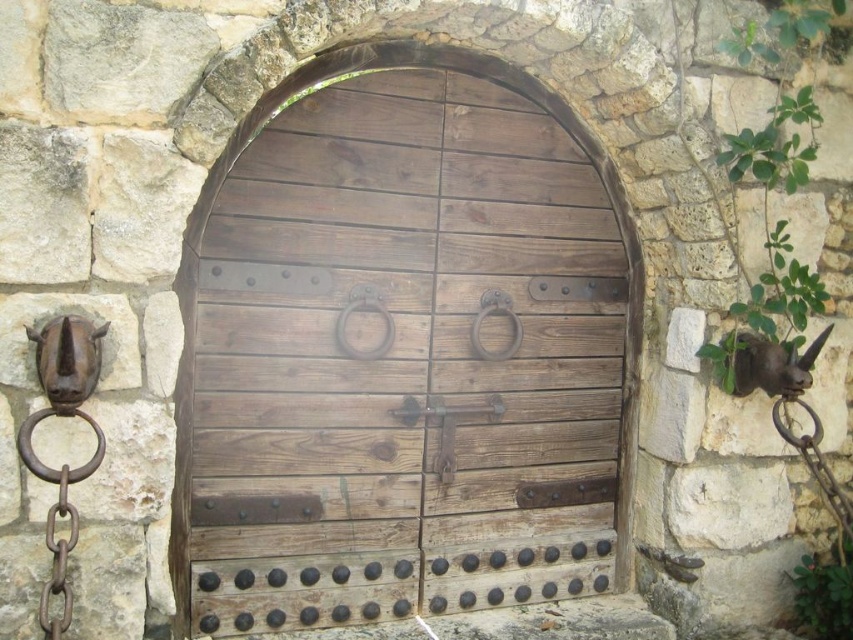
Question: Which point is closer to the camera?

Choices:
 (A) [x=207, y=387]
 (B) [x=403, y=419]

Answer: (A)

Question: Does wooden door at center appear over rustic metal door handle at center?

Choices:
 (A) no
 (B) yes

Answer: (B)

Question: Does wooden door at center appear under rustic metal door handle at center?

Choices:
 (A) yes
 (B) no

Answer: (B)

Question: Which of the following is the farthest from the observer?

Choices:
 (A) wooden door at center
 (B) rustic metal door handle at center

Answer: (B)

Question: Can you confirm if wooden door at center is bigger than rustic metal door handle at center?

Choices:
 (A) yes
 (B) no

Answer: (A)

Question: Which object appears closest to the camera in this image?

Choices:
 (A) wooden door at center
 (B) rustic metal door handle at center

Answer: (A)